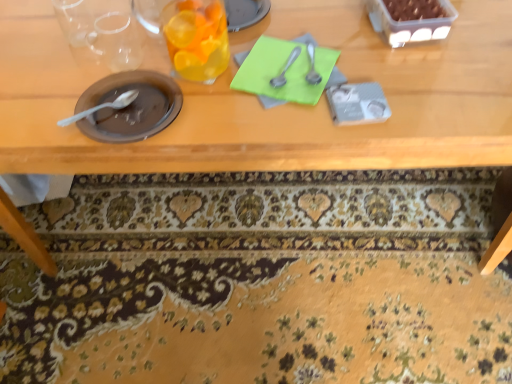
Locate an element on the screen. This screenshot has height=384, width=512. free space on the front side of satin silver spoon at upper center, the first tableware in the right-to-left sequence is located at coordinates (318, 114).